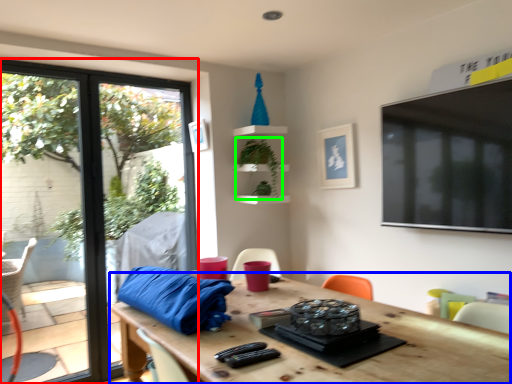
Question: Which object is positioned farthest from window (highlighted by a red box)? Select from table (highlighted by a blue box) and plant (highlighted by a green box).

Choices:
 (A) table
 (B) plant

Answer: (A)